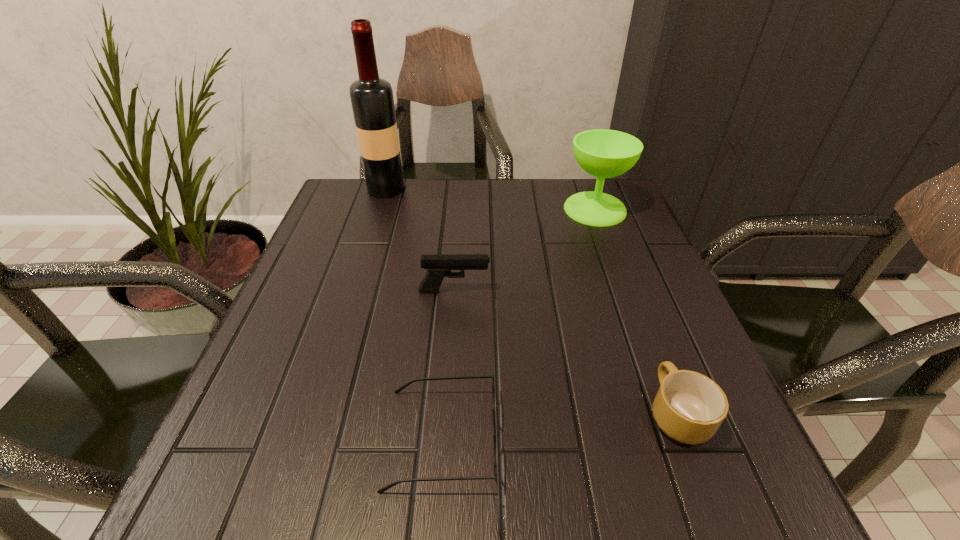
At what (x,y) coordinates should I click in order to perform the action: click on object present at the far left corner. Please return your answer as a coordinate pair (x, y). The height and width of the screenshot is (540, 960). Looking at the image, I should click on (372, 101).

Find the location of a particular element. object that is positioned at the far right corner is located at coordinates (603, 153).

This screenshot has height=540, width=960. I want to click on free space at the far edge of the desktop, so click(518, 188).

Find the location of a particular element. vacant space at the near edge of the desktop is located at coordinates (627, 476).

You are a GUI agent. You are given a task and a screenshot of the screen. Output one action in this format:
    pyautogui.click(x=<x>, y=<y>)
    Task: Click on the free space at the left edge of the desktop
    The width and height of the screenshot is (960, 540).
    Given the screenshot: What is the action you would take?
    pyautogui.click(x=354, y=287)

Find the location of a particular element. vacant space at the right edge of the desktop is located at coordinates (620, 335).

Where is `vacant space at the near left corner`? The width and height of the screenshot is (960, 540). vacant space at the near left corner is located at coordinates (277, 482).

You are a GUI agent. You are given a task and a screenshot of the screen. Output one action in this format:
    pyautogui.click(x=<x>, y=<y>)
    Task: Click on the vacant space at the far right corner
    
    Given the screenshot: What is the action you would take?
    (573, 179)

Identify the location of free space between the leftmost object and the mug. This screenshot has width=960, height=540. (531, 301).

Where is `empty space between the fourth tallest object and the second tallest object`? The height and width of the screenshot is (540, 960). empty space between the fourth tallest object and the second tallest object is located at coordinates (636, 311).